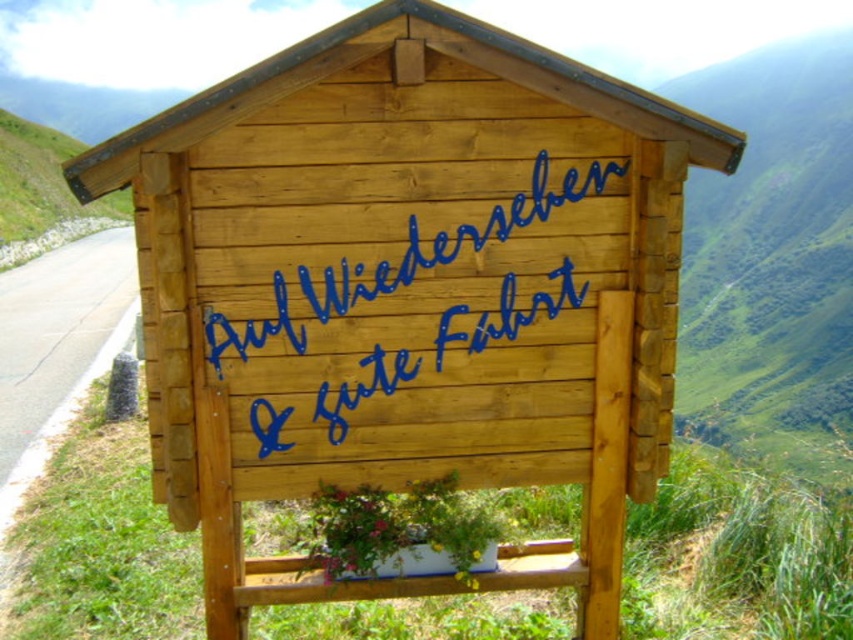
Question: Is green grassy hillside at upper right positioned before asphalt road at left?

Choices:
 (A) yes
 (B) no

Answer: (A)

Question: Which object is farther from the camera taking this photo?

Choices:
 (A) asphalt road at left
 (B) green grassy hillside at upper right

Answer: (A)

Question: Which point is closer to the camera?

Choices:
 (A) (312, 305)
 (B) (700, 177)
 (C) (3, 593)

Answer: (A)

Question: Which of these objects is positioned closest to the blue painted wood sign at center?

Choices:
 (A) green grassy hillside at upper right
 (B) asphalt road at left

Answer: (B)

Question: Does green grassy hillside at upper right have a greater width compared to blue painted wood sign at center?

Choices:
 (A) no
 (B) yes

Answer: (B)

Question: Does green grassy hillside at upper right have a lesser width compared to asphalt road at left?

Choices:
 (A) yes
 (B) no

Answer: (B)